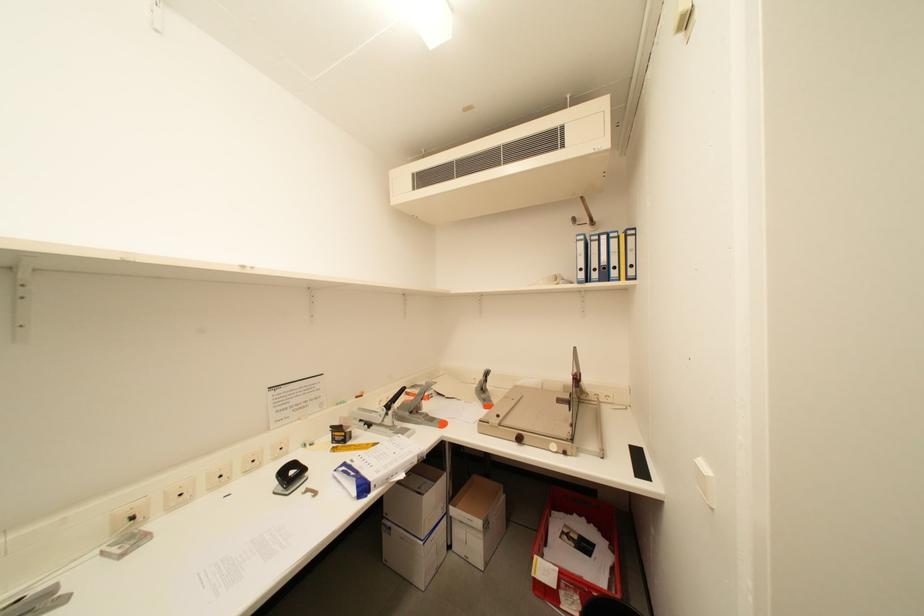
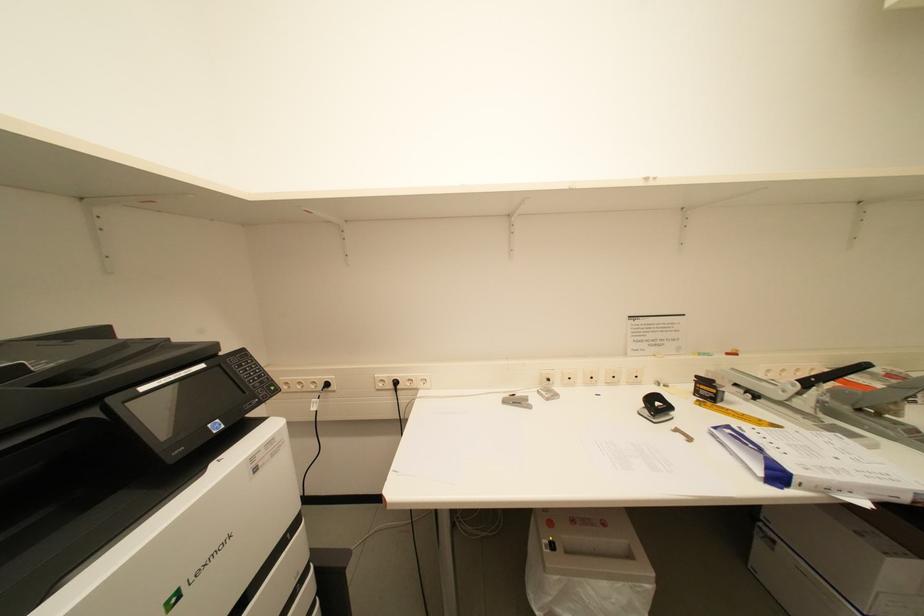
Question: The first image is from the beginning of the video and the second image is from the end. How did the camera likely rotate when shooting the video?

Choices:
 (A) Left
 (B) Right
 (C) Up
 (D) Down

Answer: (A)